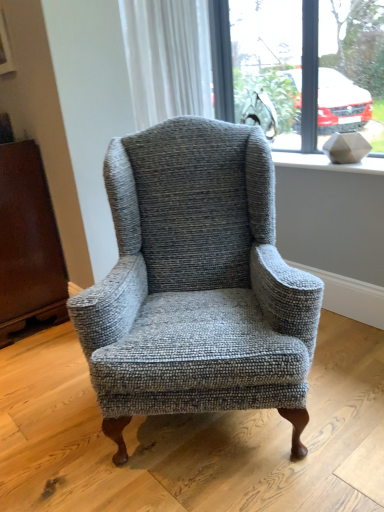
Question: From the image's perspective, is white textured stone at upper right over clear glass window at upper center?

Choices:
 (A) no
 (B) yes

Answer: (A)

Question: Could you tell me if white textured stone at upper right is turned towards clear glass window at upper center?

Choices:
 (A) no
 (B) yes

Answer: (A)

Question: Does white textured stone at upper right have a larger size compared to clear glass window at upper center?

Choices:
 (A) yes
 (B) no

Answer: (B)

Question: Considering the relative sizes of white textured stone at upper right and clear glass window at upper center in the image provided, is white textured stone at upper right wider than clear glass window at upper center?

Choices:
 (A) no
 (B) yes

Answer: (B)

Question: Does white textured stone at upper right have a smaller size compared to clear glass window at upper center?

Choices:
 (A) no
 (B) yes

Answer: (B)

Question: Does white textured stone at upper right have a lesser height compared to clear glass window at upper center?

Choices:
 (A) no
 (B) yes

Answer: (B)

Question: Could you tell me if white textured curtain at upper center is turned towards textured gray armchair at center?

Choices:
 (A) yes
 (B) no

Answer: (B)

Question: Considering the relative sizes of white textured curtain at upper center and textured gray armchair at center in the image provided, is white textured curtain at upper center wider than textured gray armchair at center?

Choices:
 (A) yes
 (B) no

Answer: (B)

Question: Is white textured curtain at upper center taller than textured gray armchair at center?

Choices:
 (A) yes
 (B) no

Answer: (B)

Question: Does white textured curtain at upper center have a lesser height compared to textured gray armchair at center?

Choices:
 (A) no
 (B) yes

Answer: (B)

Question: Considering the relative positions of white textured curtain at upper center and textured gray armchair at center in the image provided, is white textured curtain at upper center behind textured gray armchair at center?

Choices:
 (A) yes
 (B) no

Answer: (A)

Question: Is white textured curtain at upper center turned away from textured gray armchair at center?

Choices:
 (A) yes
 (B) no

Answer: (B)

Question: From a real-world perspective, is white textured curtain at upper center over clear glass window at upper center?

Choices:
 (A) no
 (B) yes

Answer: (B)